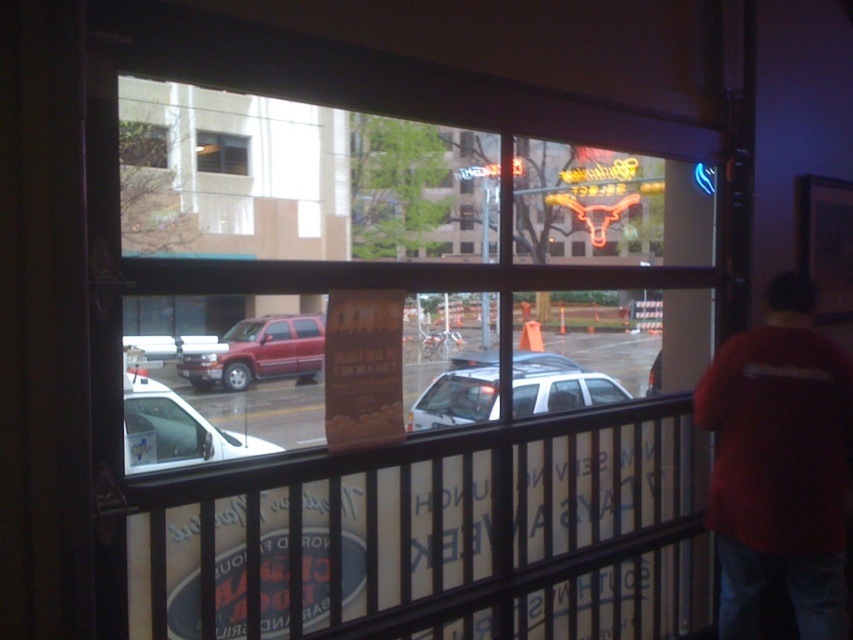
You are standing inside a building and looking through the transparent glass window at center. You see the metallic red truck at center outside. Is the truck physically touching the window?

The metallic red truck at center is below the transparent glass window at center, so it is not touching the window.